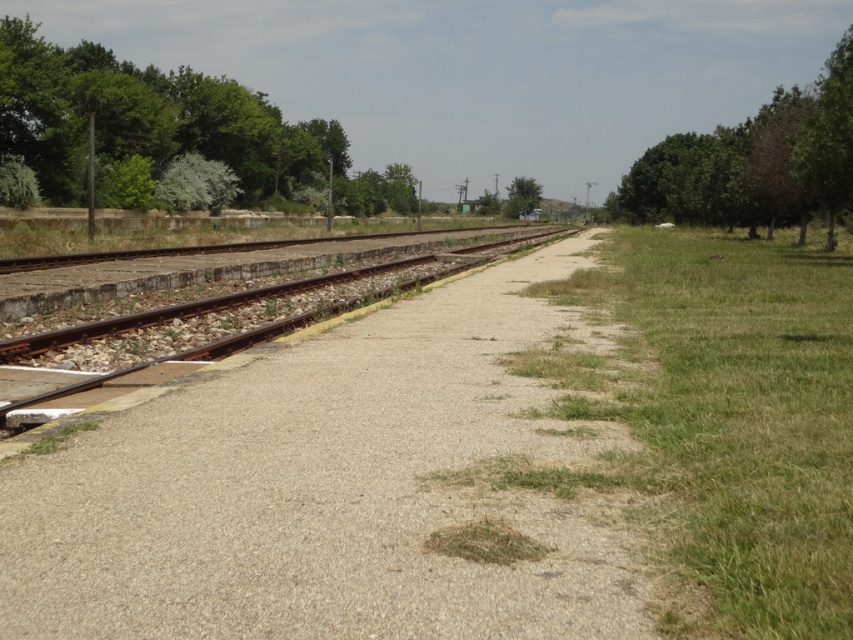
Between point (686, 300) and point (521, 188), which one is positioned in front?

Point (686, 300)

Measure the distance between green grass at right and camera.

A distance of 3.55 meters exists between green grass at right and camera.

Find the location of a particular element. green grass at right is located at coordinates (723, 420).

The image size is (853, 640). I want to click on green leafy tree at left, so click(167, 128).

Which is above, green leafy tree at left or green leafy tree at center?

green leafy tree at left is above.

The width and height of the screenshot is (853, 640). I want to click on green leafy tree at left, so click(x=167, y=128).

Which is above, green leafy tree at left or green leafy tree at upper right?

green leafy tree at left

Can you confirm if green leafy tree at left is positioned below green leafy tree at upper right?

No.

Who is more distant from viewer, (199, 136) or (801, 241)?

Positioned behind is point (199, 136).

This screenshot has width=853, height=640. In order to click on green leafy tree at left in this screenshot , I will do `click(167, 128)`.